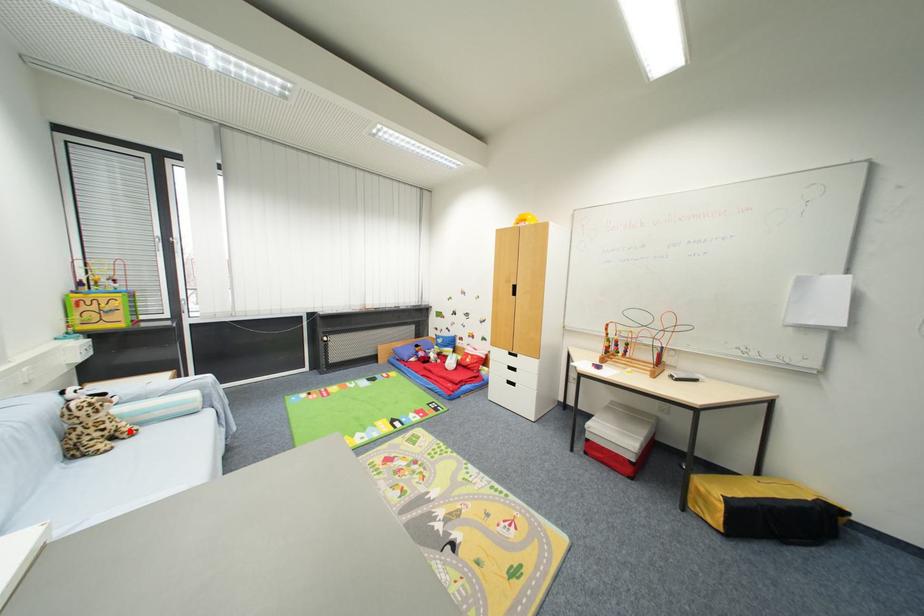
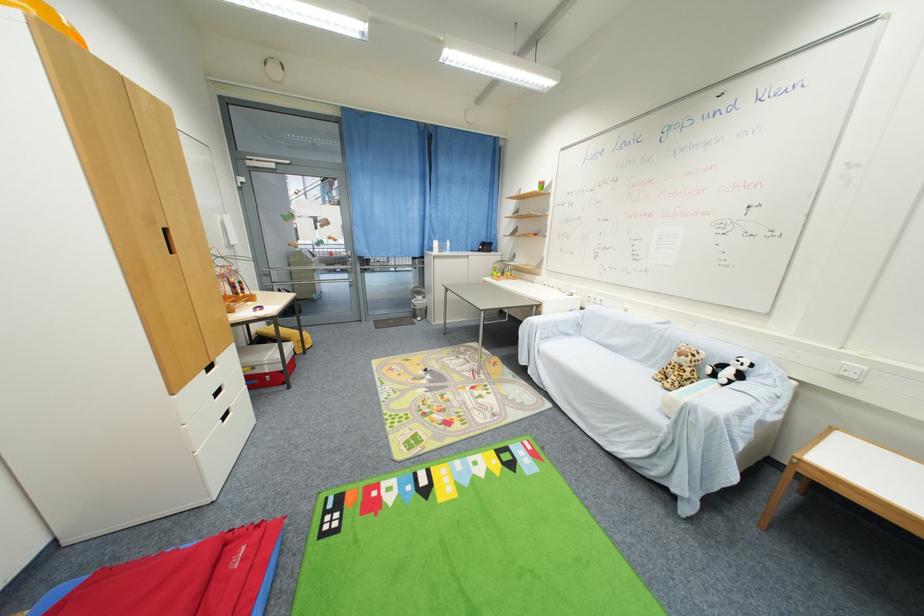
Locate, in the second image, the point that corresponds to the highlighted location in the first image.

(675, 382)